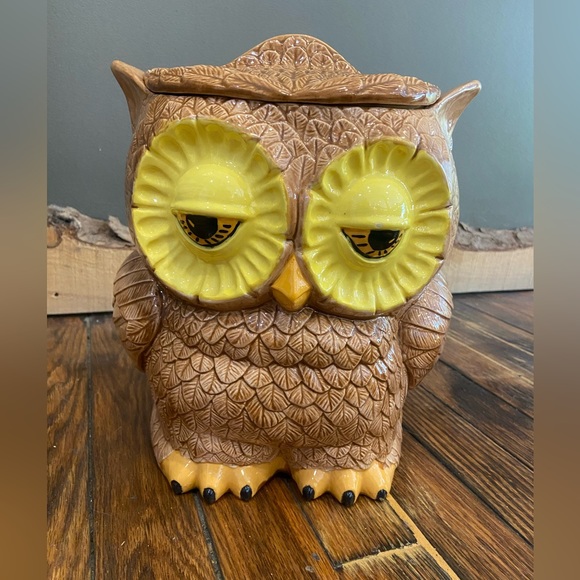
The image size is (580, 580). I want to click on wood wall siding, so click(78, 251), click(492, 264).